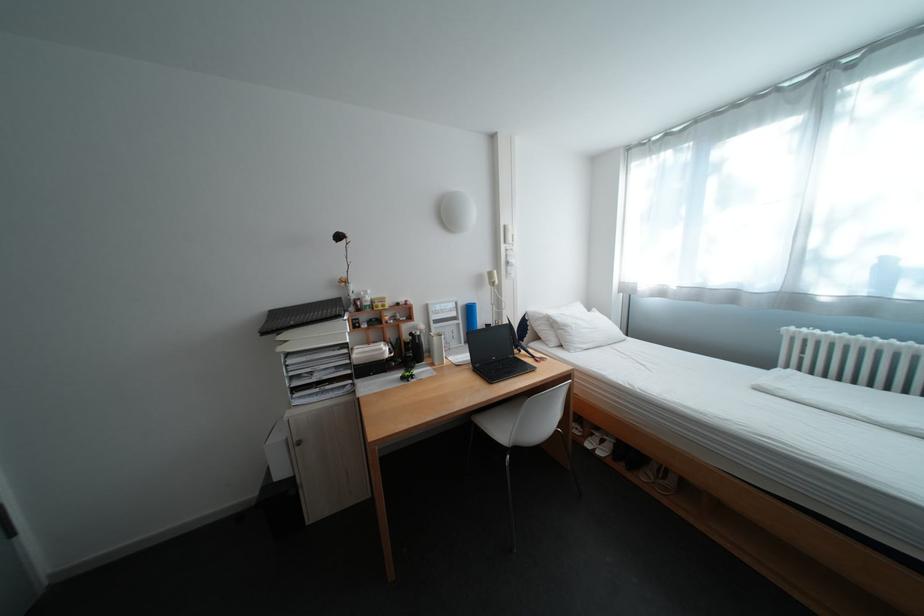
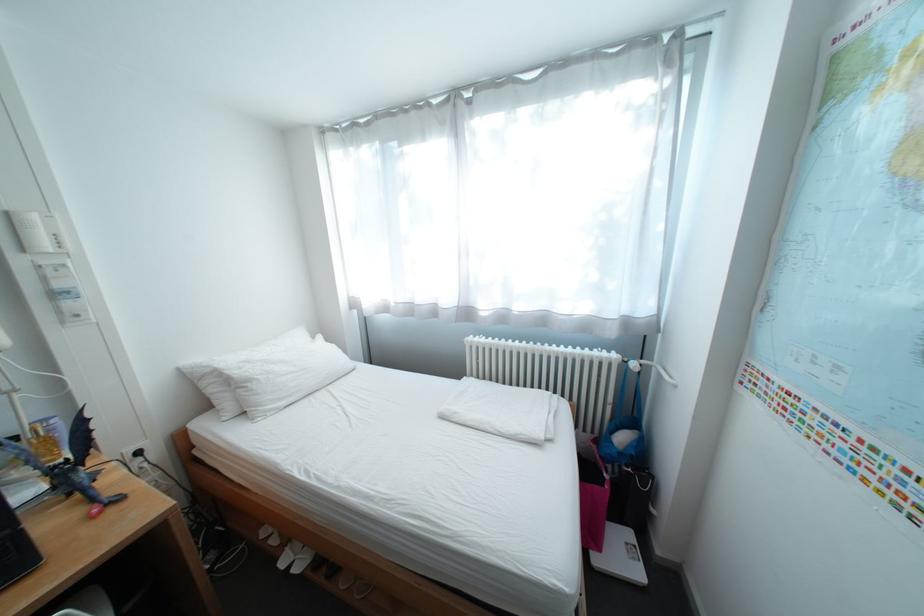
The point at (609, 450) is marked in the first image. Where is the corresponding point in the second image?

(307, 562)